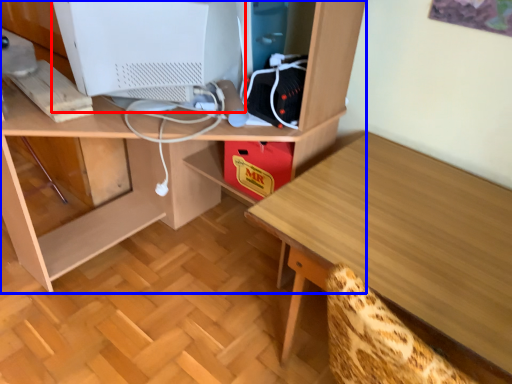
Question: Which of the following is the farthest to the observer, computer monitor (highlighted by a red box) or desk (highlighted by a blue box)?

Choices:
 (A) computer monitor
 (B) desk

Answer: (A)